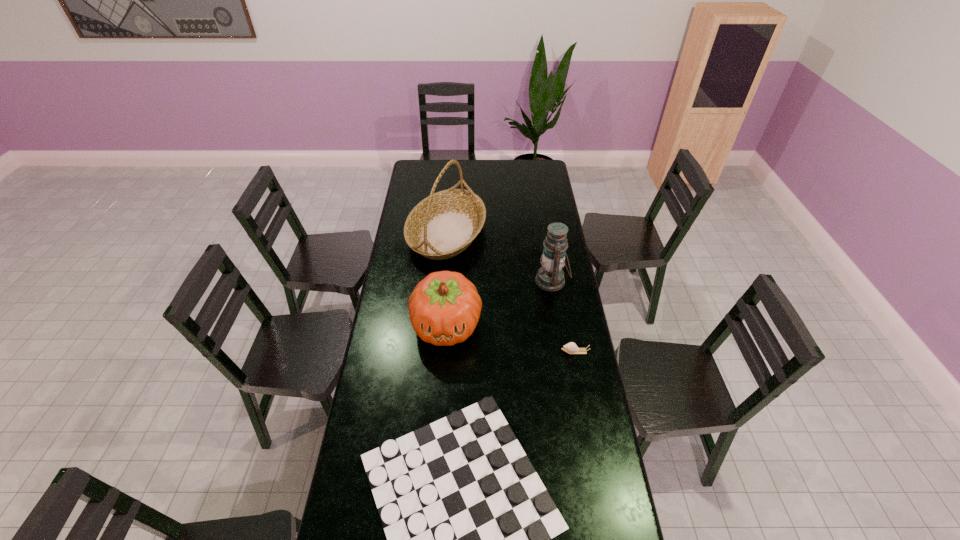
At what (x,y) coordinates should I click in order to perform the action: click on basket. Please return your answer as a coordinate pair (x, y). Looking at the image, I should click on (441, 226).

I want to click on the fourth shortest object, so click(x=550, y=277).

Where is `pumpkin`? The width and height of the screenshot is (960, 540). pumpkin is located at coordinates (444, 308).

Image resolution: width=960 pixels, height=540 pixels. I want to click on the fourth tallest object, so click(571, 348).

Locate an element on the screen. This screenshot has height=540, width=960. vacant space positioned on the front of the basket is located at coordinates (443, 282).

Locate an element on the screen. The height and width of the screenshot is (540, 960). vacant space located 0.080m on the front of the oil lamp is located at coordinates (557, 311).

Identify the location of vacant space located 0.290m on the side of the third shortest object with the cute face. This screenshot has height=540, width=960. (440, 424).

You are a GUI agent. You are given a task and a screenshot of the screen. Output one action in this format:
    pyautogui.click(x=<x>, y=<y>)
    Task: Click on the free region located on the shell of the escargot
    This screenshot has width=960, height=540.
    Given the screenshot: What is the action you would take?
    pyautogui.click(x=541, y=352)

Locate an element on the screen. This screenshot has height=540, width=960. free space located on the shell of the escargot is located at coordinates (521, 352).

Identify the location of vacant area situated on the shell of the escargot. (489, 352).